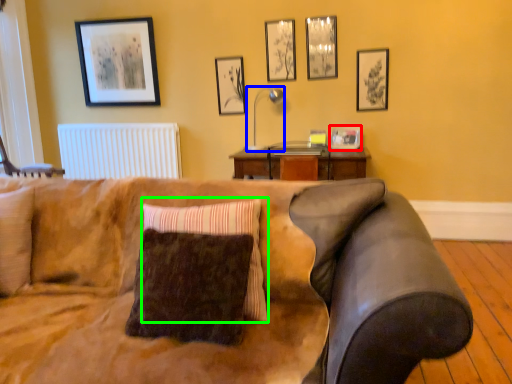
Question: Based on their relative distances, which object is nearer to picture frame (highlighted by a red box)? Choose from lamp (highlighted by a blue box) and pillow (highlighted by a green box).

Choices:
 (A) lamp
 (B) pillow

Answer: (A)